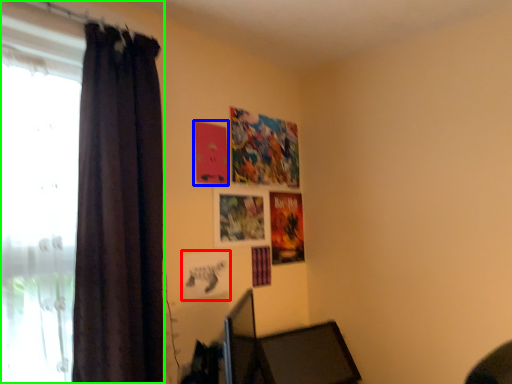
Question: Which is nearer to the picture frame (highlighted by a red box)? poster page (highlighted by a blue box) or curtain (highlighted by a green box).

Choices:
 (A) poster page
 (B) curtain

Answer: (A)